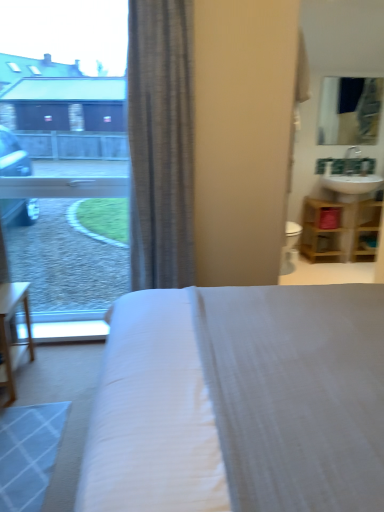
Question: Is wooden shelf at right wider than transparent glass window at upper left?

Choices:
 (A) yes
 (B) no

Answer: (A)

Question: Does wooden shelf at right lie behind transparent glass window at upper left?

Choices:
 (A) yes
 (B) no

Answer: (A)

Question: Can you see wooden shelf at right touching transparent glass window at upper left?

Choices:
 (A) no
 (B) yes

Answer: (A)

Question: Is wooden shelf at right shorter than transparent glass window at upper left?

Choices:
 (A) no
 (B) yes

Answer: (B)

Question: Is transparent glass window at upper left at the back of wooden shelf at right?

Choices:
 (A) yes
 (B) no

Answer: (B)

Question: From a real-world perspective, is wooden shelf at right located higher than transparent glass window at upper left?

Choices:
 (A) no
 (B) yes

Answer: (A)

Question: Can you confirm if white fabric bed at center is wider than wooden shelf at right?

Choices:
 (A) yes
 (B) no

Answer: (A)

Question: Can you confirm if white fabric bed at center is bigger than wooden shelf at right?

Choices:
 (A) no
 (B) yes

Answer: (B)

Question: Is white fabric bed at center positioned with its back to wooden shelf at right?

Choices:
 (A) no
 (B) yes

Answer: (A)

Question: Are white fabric bed at center and wooden shelf at right located far from each other?

Choices:
 (A) no
 (B) yes

Answer: (B)

Question: From a real-world perspective, is white fabric bed at center over wooden shelf at right?

Choices:
 (A) yes
 (B) no

Answer: (A)

Question: Could you tell me if white fabric bed at center is turned towards wooden shelf at right?

Choices:
 (A) yes
 (B) no

Answer: (B)

Question: From the image's perspective, is white fabric bed at center below gray textured curtain at center?

Choices:
 (A) no
 (B) yes

Answer: (B)